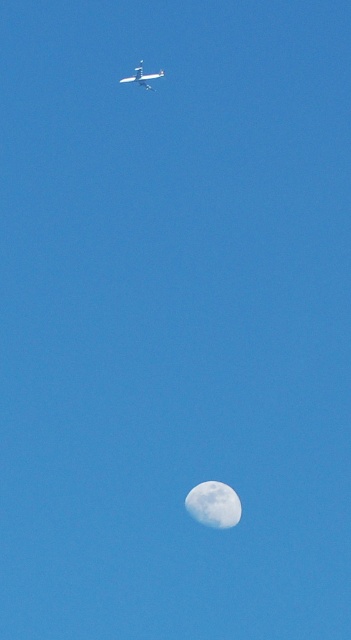
You are an astronaut floating in space and see the metallic silver airplane at upper center and the white textured moon at lower center. Which object appears closer to you?

The white textured moon at lower center appears closer to you because the metallic silver airplane at upper center is behind it.

You are an astronaut floating in space and see the white textured moon at lower center and the metallic silver airplane at upper center. Which object appears larger in size?

The white textured moon at lower center appears larger in size than the metallic silver airplane at upper center because its width surpasses that of the airplane.